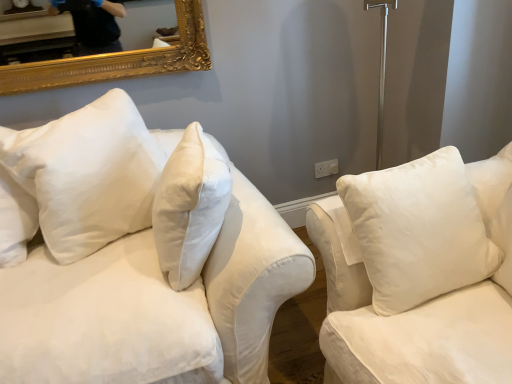
Question: Is white cotton pillow at upper left, the second pillow positioned from the right, aimed at white soft cushion at right, the 1th pillow viewed from the right?

Choices:
 (A) no
 (B) yes

Answer: (B)

Question: Can you confirm if white cotton pillow at upper left, the 1th pillow positioned from the left, is wider than white soft cushion at right, placed as the second pillow when sorted from left to right?

Choices:
 (A) yes
 (B) no

Answer: (B)

Question: Is the depth of white cotton pillow at upper left, the 1th pillow positioned from the left, greater than that of white soft cushion at right, the 1th pillow viewed from the right?

Choices:
 (A) no
 (B) yes

Answer: (B)

Question: Is white cotton pillow at upper left, the 1th pillow positioned from the left, in contact with white soft cushion at right, the 1th pillow viewed from the right?

Choices:
 (A) yes
 (B) no

Answer: (B)

Question: Is white cotton pillow at upper left, the 1th pillow positioned from the left, oriented away from white soft cushion at right, the 1th pillow viewed from the right?

Choices:
 (A) no
 (B) yes

Answer: (A)

Question: Is white cotton pillow at upper left, the 1th pillow positioned from the left, far away from white soft cushion at right, the 1th pillow viewed from the right?

Choices:
 (A) yes
 (B) no

Answer: (B)

Question: Would you say white cotton pillow at upper left, the 1th pillow positioned from the left, contains white plastic electric outlet at center-right?

Choices:
 (A) no
 (B) yes

Answer: (A)

Question: Is white cotton pillow at upper left, the 1th pillow positioned from the left, to the right of white plastic electric outlet at center-right from the viewer's perspective?

Choices:
 (A) no
 (B) yes

Answer: (A)

Question: Can you confirm if white cotton pillow at upper left, the second pillow positioned from the right, is wider than white plastic electric outlet at center-right?

Choices:
 (A) yes
 (B) no

Answer: (A)

Question: Can you confirm if white cotton pillow at upper left, the 1th pillow positioned from the left, is smaller than white plastic electric outlet at center-right?

Choices:
 (A) yes
 (B) no

Answer: (B)

Question: Is white cotton pillow at upper left, the 1th pillow positioned from the left, outside white plastic electric outlet at center-right?

Choices:
 (A) no
 (B) yes

Answer: (B)

Question: Is white cotton pillow at upper left, the 1th pillow positioned from the left, to the left of white plastic electric outlet at center-right from the viewer's perspective?

Choices:
 (A) yes
 (B) no

Answer: (A)

Question: From the image's perspective, is white cotton couch at left located above white plastic electric outlet at center-right?

Choices:
 (A) no
 (B) yes

Answer: (A)